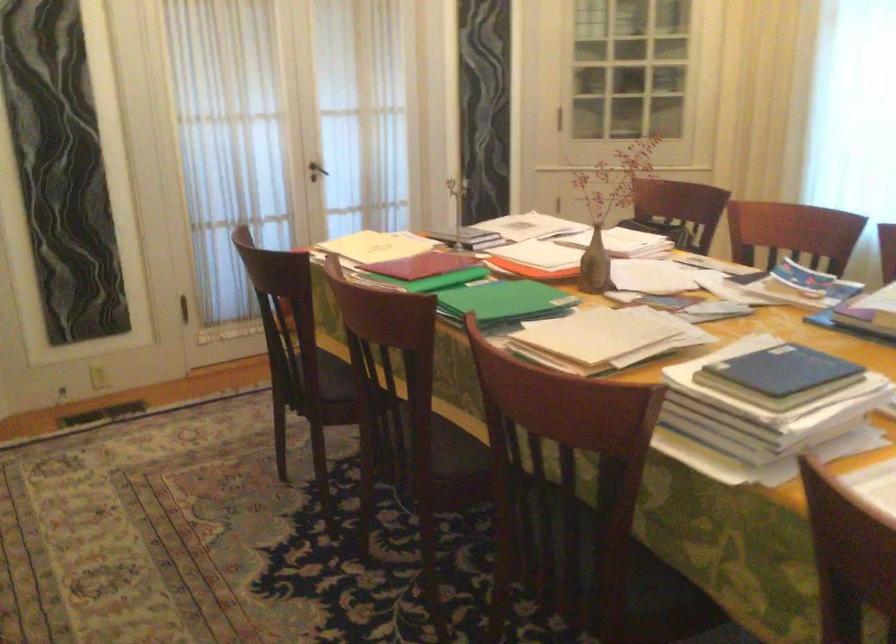
This screenshot has width=896, height=644. I want to click on red folder, so click(x=423, y=265).